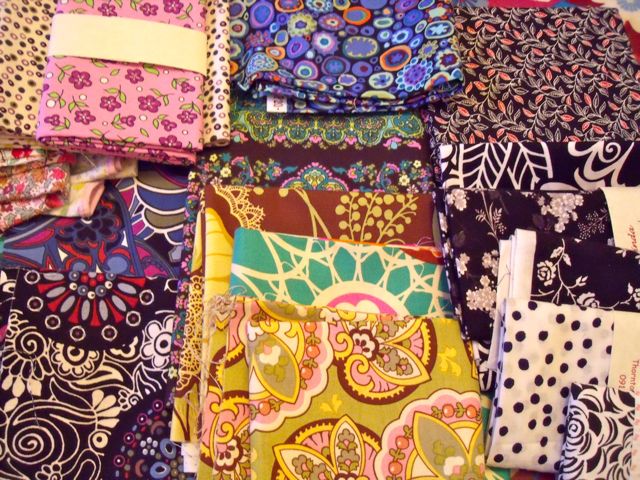
Find the location of `ivory flowers`. ivory flowers is located at coordinates (564, 217).